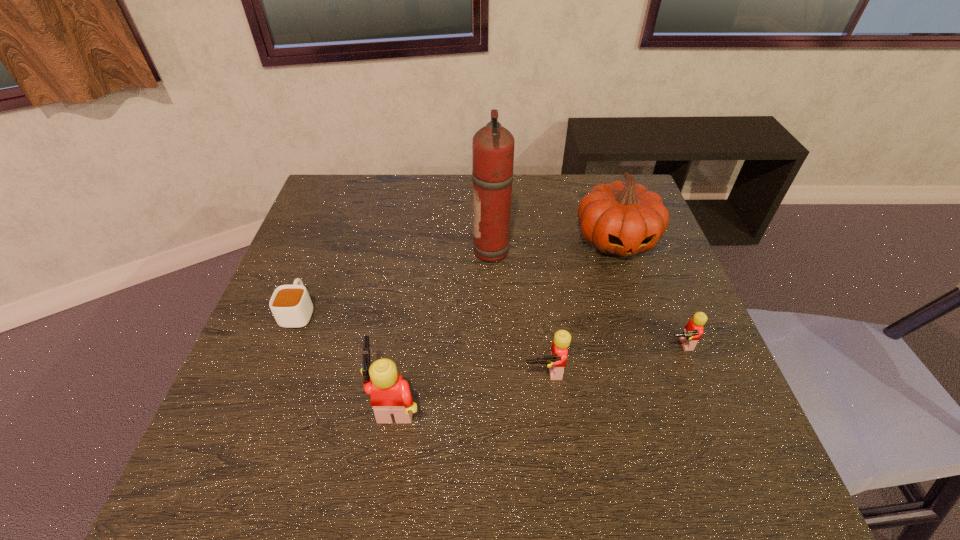
The width and height of the screenshot is (960, 540). Identify the location of free spot that satisfies the following two spatial constraints: 1. in front of the second Lego from right to left with the accessory visible; 2. in front of the fifth object from right to left with the accessory visible. (548, 401).

Identify the location of blank space that satisfies the following two spatial constraints: 1. in front of the second Lego from left to right with the accessory visible; 2. in front of the tallest Lego with the accessory visible. Image resolution: width=960 pixels, height=540 pixels. (548, 401).